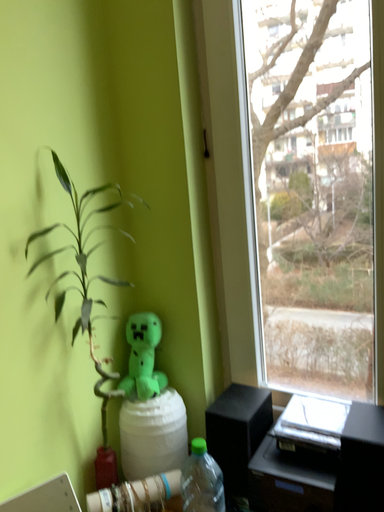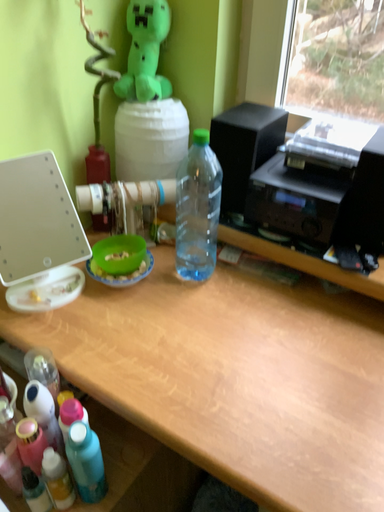
Question: How did the camera likely rotate when shooting the video?

Choices:
 (A) rotated downward
 (B) rotated upward

Answer: (A)